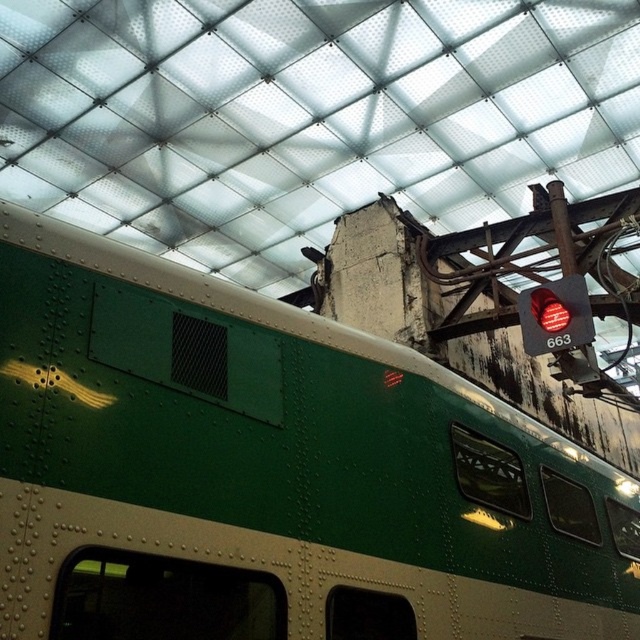
Does green riveted metal train at center have a larger size compared to red glass traffic light at upper right?

Yes.

Is green riveted metal train at center to the left of red glass traffic light at upper right from the viewer's perspective?

Yes, green riveted metal train at center is to the left of red glass traffic light at upper right.

This screenshot has height=640, width=640. I want to click on green riveted metal train at center, so click(273, 472).